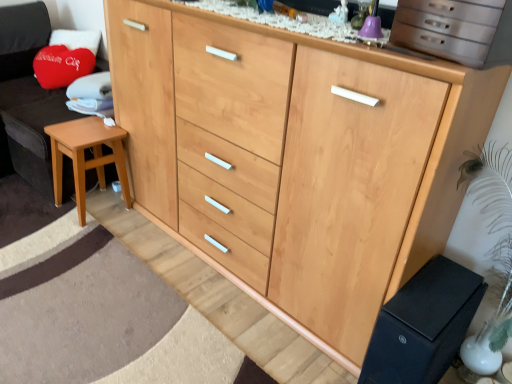
Question: From a real-world perspective, relative to metallic silver drawers at upper right, is black matte changing table at lower right vertically above or below?

Choices:
 (A) above
 (B) below

Answer: (B)

Question: Based on their positions, is black matte changing table at lower right located to the left or right of metallic silver drawers at upper right?

Choices:
 (A) right
 (B) left

Answer: (A)

Question: Which object is positioned farthest from the light brown wood stool at lower left?

Choices:
 (A) wooden stool at left
 (B) black matte changing table at lower right
 (C) metallic silver drawers at upper right

Answer: (B)

Question: Which object is the closest to the light brown wood stool at lower left?

Choices:
 (A) black matte changing table at lower right
 (B) metallic silver drawers at upper right
 (C) wooden stool at left

Answer: (C)